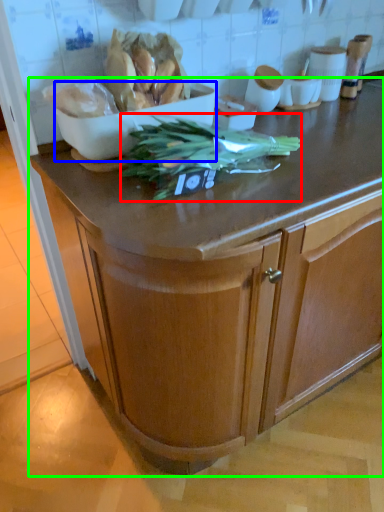
Question: Which object is positioned closest to vegetable (highlighted by a red box)? Select from bowl (highlighted by a blue box) and cabinetry (highlighted by a green box).

Choices:
 (A) bowl
 (B) cabinetry

Answer: (A)